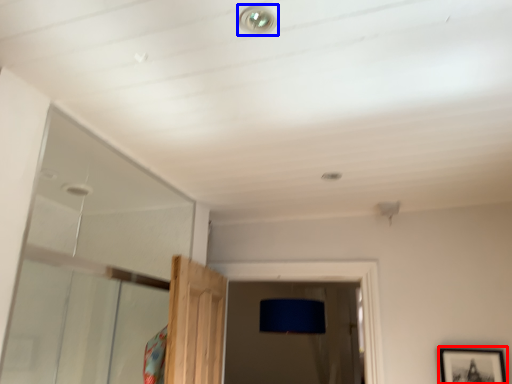
Question: Which object is closer to the camera taking this photo, picture frame (highlighted by a red box) or droplight (highlighted by a blue box)?

Choices:
 (A) picture frame
 (B) droplight

Answer: (B)